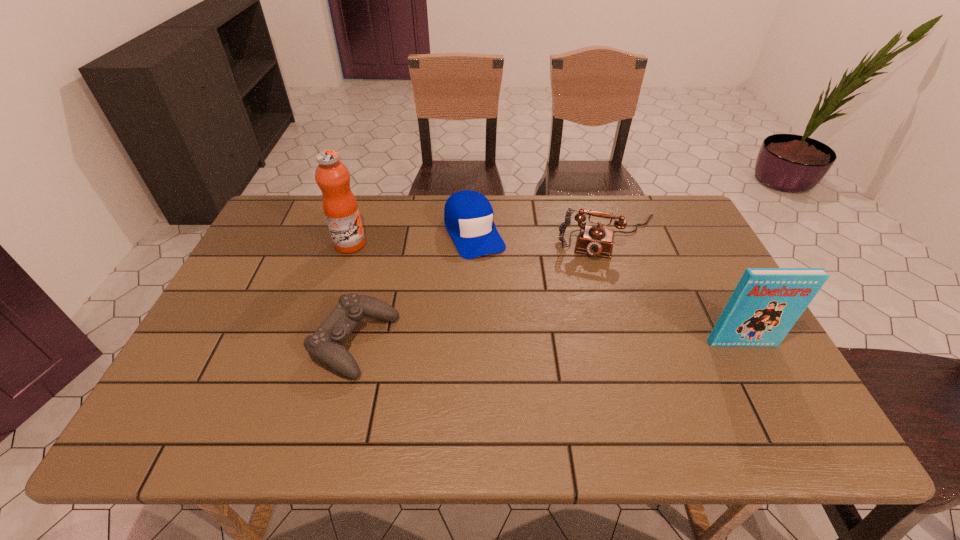
The image size is (960, 540). Identify the location of empty space that is in between the fruit juice and the fourth shortest object. (546, 294).

At what (x,y) coordinates should I click in order to perform the action: click on blank region between the baseball cap and the fourth shortest object. Please return your answer as a coordinate pair (x, y). Looking at the image, I should click on (608, 287).

Find the location of `empty location between the third object from left to right and the tallest object`. empty location between the third object from left to right and the tallest object is located at coordinates (412, 238).

Identify the location of free space between the tallest object and the second shortest object. (412, 238).

The height and width of the screenshot is (540, 960). Find the location of `vacant point located between the fruit juice and the second tallest object`. vacant point located between the fruit juice and the second tallest object is located at coordinates (546, 294).

I want to click on free space between the tallest object and the second tallest object, so click(x=546, y=294).

You are a GUI agent. You are given a task and a screenshot of the screen. Output one action in this format:
    pyautogui.click(x=<x>, y=<y>)
    Task: Click on the free spot between the control and the telephone
    The image size is (960, 540).
    Given the screenshot: What is the action you would take?
    pyautogui.click(x=483, y=290)

The image size is (960, 540). In order to click on object that is the fourth closest to the tallest object in this screenshot , I will do `click(766, 303)`.

Where is `object that stands as the third closest to the shortest object`? object that stands as the third closest to the shortest object is located at coordinates (595, 240).

In order to click on free location that satisfies the following two spatial constraints: 1. on the back side of the shortest object; 2. on the left side of the third tallest object in this screenshot , I will do `click(382, 238)`.